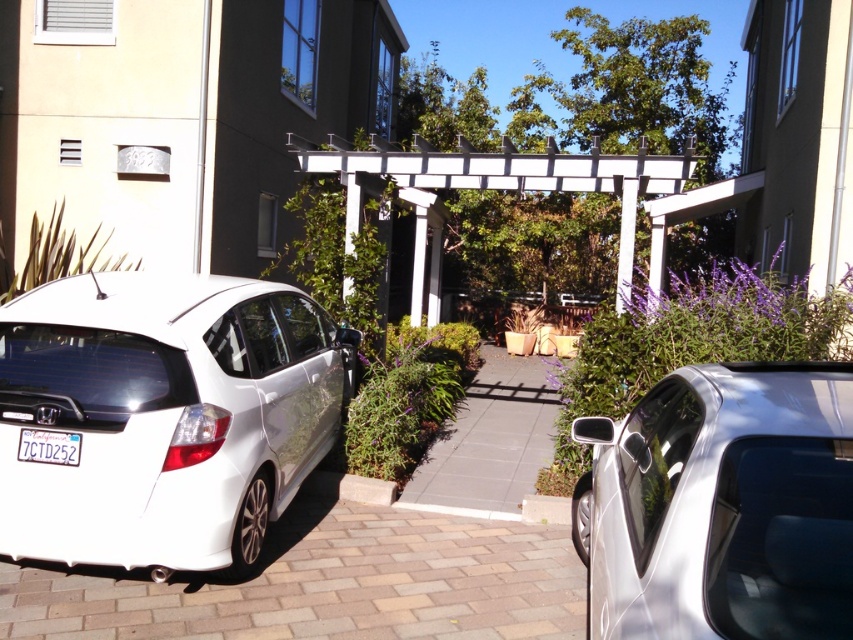
Question: Which of the following is the farthest from the observer?

Choices:
 (A) (416, 147)
 (B) (496, 570)
 (C) (747, 611)

Answer: (A)

Question: Among these points, which one is nearest to the camera?

Choices:
 (A) (277, 566)
 (B) (508, 141)

Answer: (A)

Question: Is brick paved driveway at lower left to the left of white wood pergola at center from the viewer's perspective?

Choices:
 (A) no
 (B) yes

Answer: (B)

Question: Does satin silver car at lower left appear under brick paved driveway at lower left?

Choices:
 (A) no
 (B) yes

Answer: (A)

Question: Which object appears closest to the camera in this image?

Choices:
 (A) satin silver car at lower left
 (B) white wood pergola at center
 (C) white plastic license plate at lower left
 (D) gray concrete driveway at center

Answer: (A)

Question: Is satin silver car at lower left to the right of white wood pergola at center from the viewer's perspective?

Choices:
 (A) yes
 (B) no

Answer: (B)